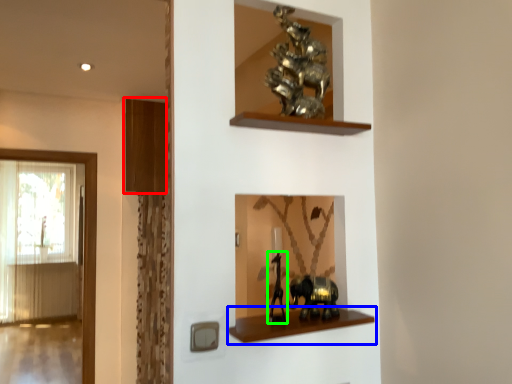
Question: Which object is the closest to the shelf (highlighted by a red box)? Choose among these: shelf (highlighted by a blue box) or animal (highlighted by a green box).

Choices:
 (A) shelf
 (B) animal

Answer: (B)